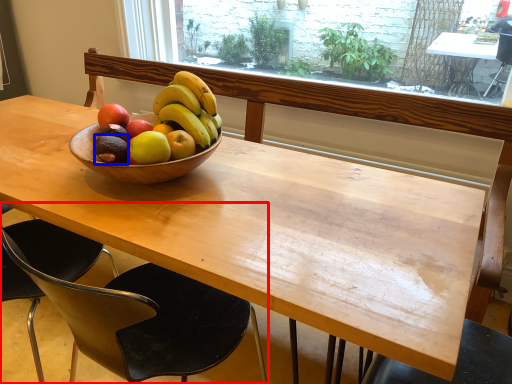
Question: Which object is further to the camera taking this photo, chair (highlighted by a red box) or avocado (highlighted by a blue box)?

Choices:
 (A) chair
 (B) avocado

Answer: (B)